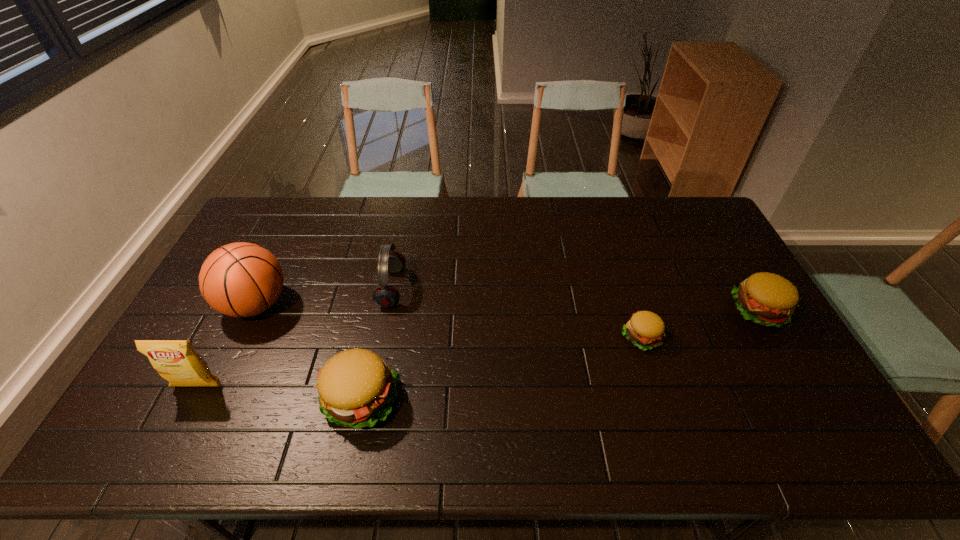
The image size is (960, 540). Find the location of `unoccupied area between the crisp (potato chip) and the earphone`. unoccupied area between the crisp (potato chip) and the earphone is located at coordinates (295, 338).

At what (x,y) coordinates should I click in order to perform the action: click on empty space between the fifth object from left to right and the crisp (potato chip). Please return your answer as a coordinate pair (x, y). The width and height of the screenshot is (960, 540). Looking at the image, I should click on (420, 362).

The image size is (960, 540). In order to click on vacant area between the crisp (potato chip) and the basketball in this screenshot , I will do `click(228, 346)`.

This screenshot has width=960, height=540. Identify the location of vacant region between the crisp (potato chip) and the rightmost object. (479, 348).

Find the location of a particular element. vacant space in between the nearest hamburger and the fifth tallest object is located at coordinates (560, 355).

Identify which object is located as the nearest to the crisp (potato chip). Please provide its 2D coordinates. Your answer should be formatted as a tuple, i.e. [(x, y)], where the tuple contains the x and y coordinates of a point satisfying the conditions above.

[(241, 279)]

Select which object is the fourth closest to the crisp (potato chip). Please provide its 2D coordinates. Your answer should be formatted as a tuple, i.e. [(x, y)], where the tuple contains the x and y coordinates of a point satisfying the conditions above.

[(645, 329)]

At what (x,y) coordinates should I click in order to perform the action: click on hamburger that is the second closest to the leftmost hamburger. Please return your answer as a coordinate pair (x, y). The width and height of the screenshot is (960, 540). Looking at the image, I should click on (767, 299).

Locate which hamburger ranks second in proximity to the nearest hamburger. Please provide its 2D coordinates. Your answer should be formatted as a tuple, i.e. [(x, y)], where the tuple contains the x and y coordinates of a point satisfying the conditions above.

[(767, 299)]

What are the coordinates of `free point that satisfies the following two spatial constraints: 1. on the front side of the leftmost hamburger; 2. on the right side of the basketball` in the screenshot? It's located at (210, 400).